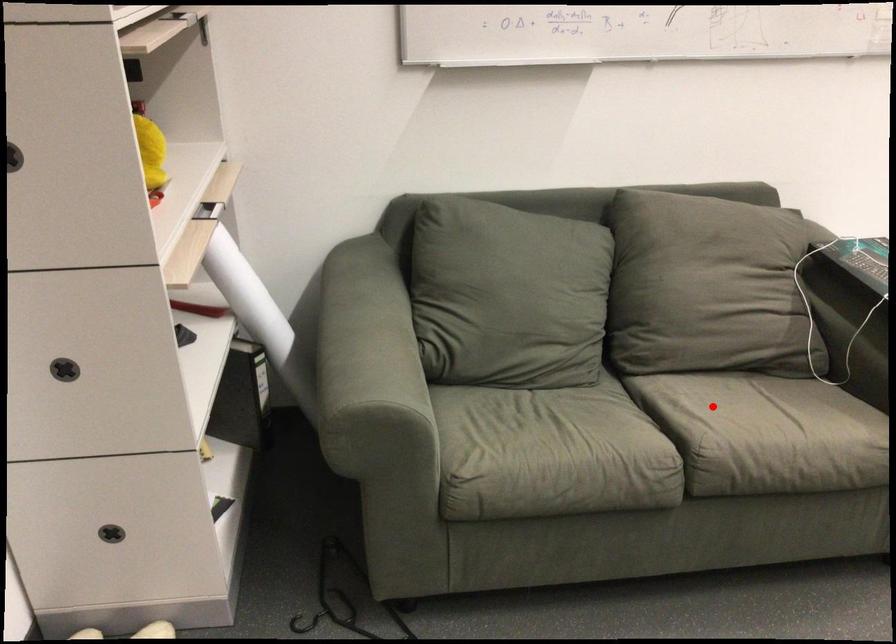
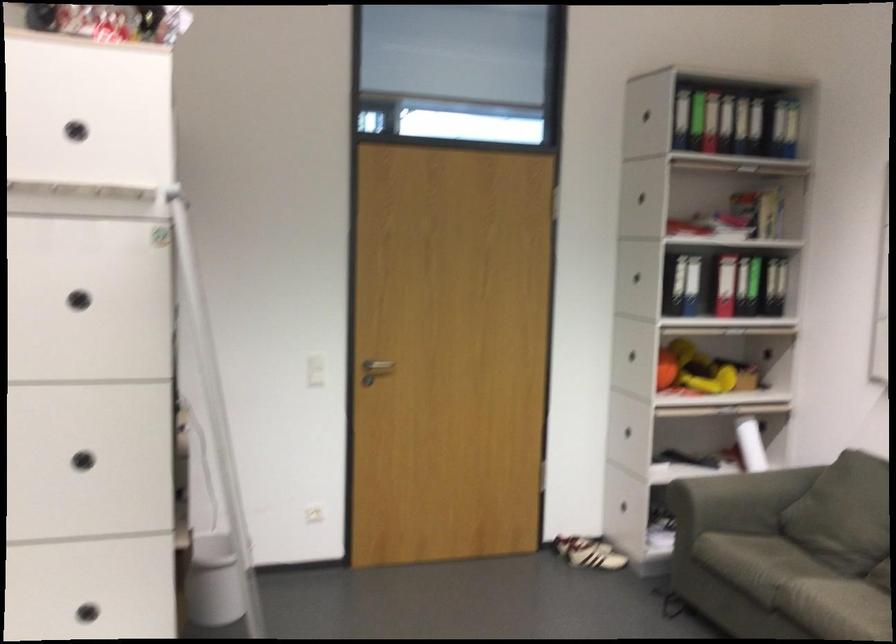
Question: I am providing you with two images of the same scene from different viewpoints. Given a red point in image1, look at the same physical point in image2. Is it:

Choices:
 (A) Closer to the viewpoint
 (B) Farther from the viewpoint

Answer: (B)